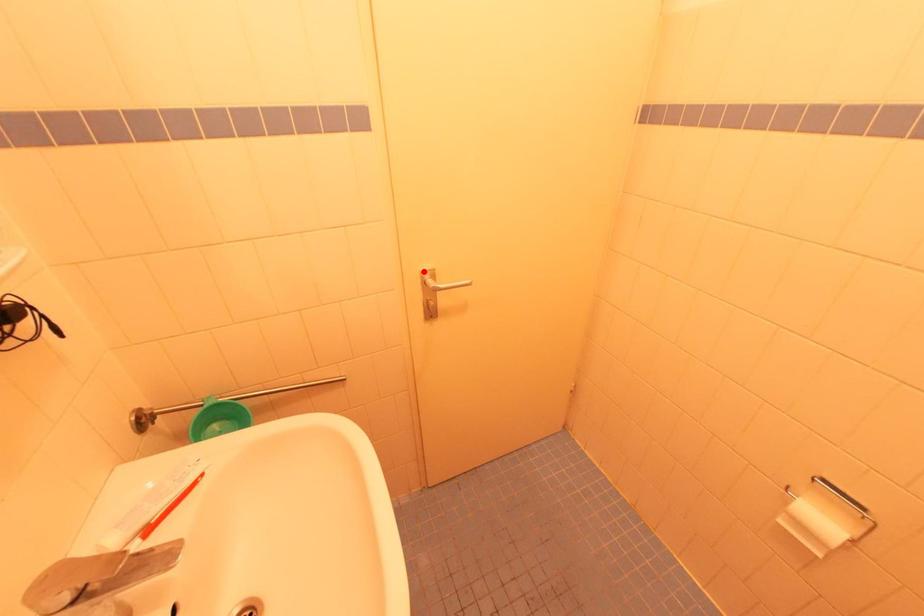
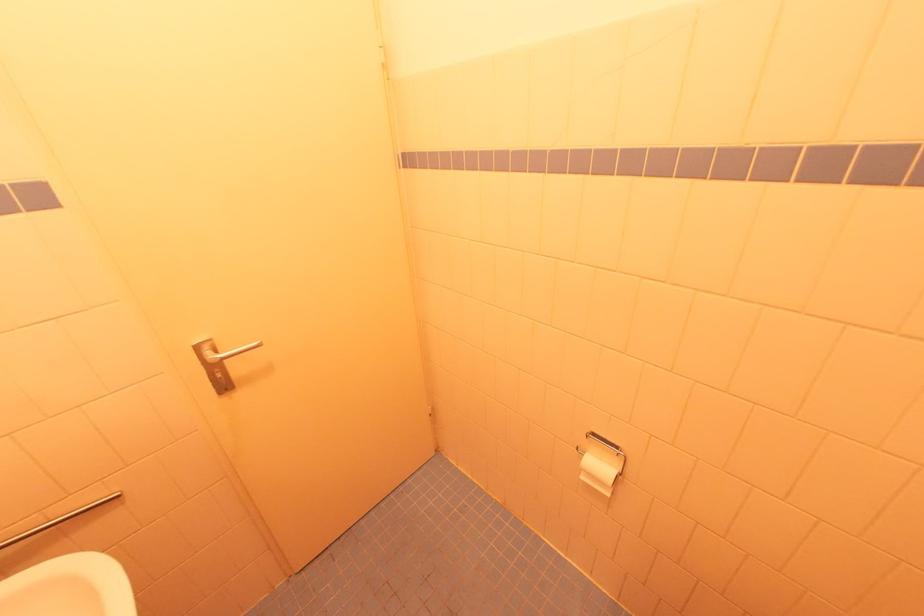
Locate, in the second image, the point that corresponds to the highlighted location in the first image.

(197, 345)